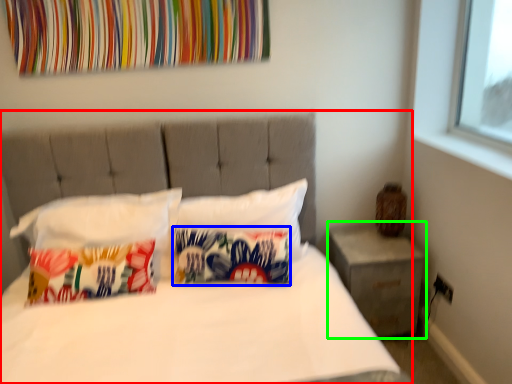
Question: Considering the real-world distances, which object is closest to bed (highlighted by a red box)? pillow (highlighted by a blue box) or nightstand (highlighted by a green box).

Choices:
 (A) pillow
 (B) nightstand

Answer: (A)